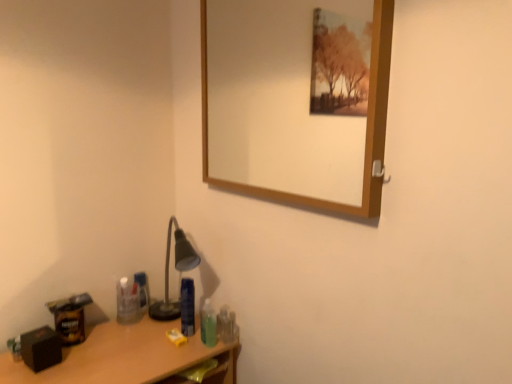
Image resolution: width=512 pixels, height=384 pixels. Identify the location of vacant space in front of translucent plastic bottle at center, positioned as the 4th toiletry in front-to-back order. (133, 330).